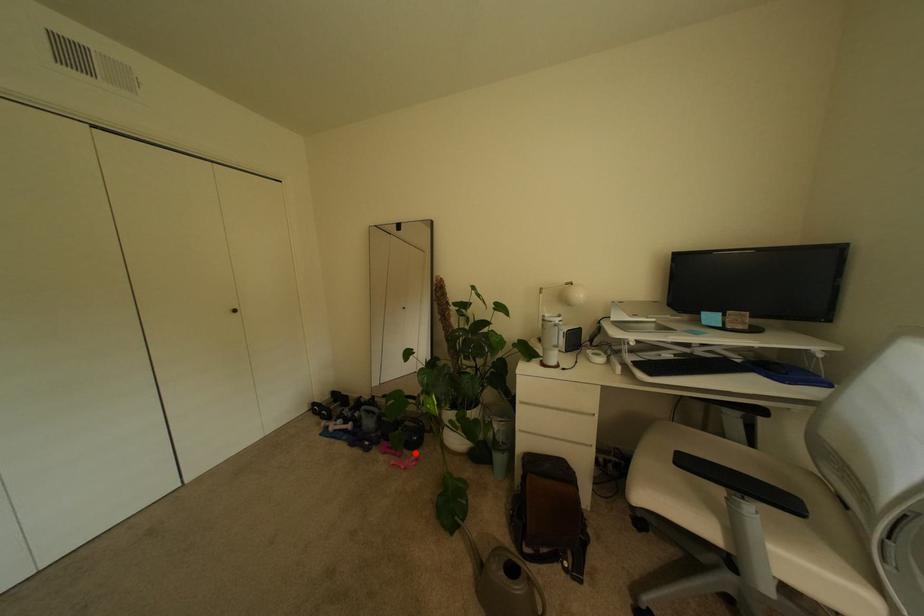
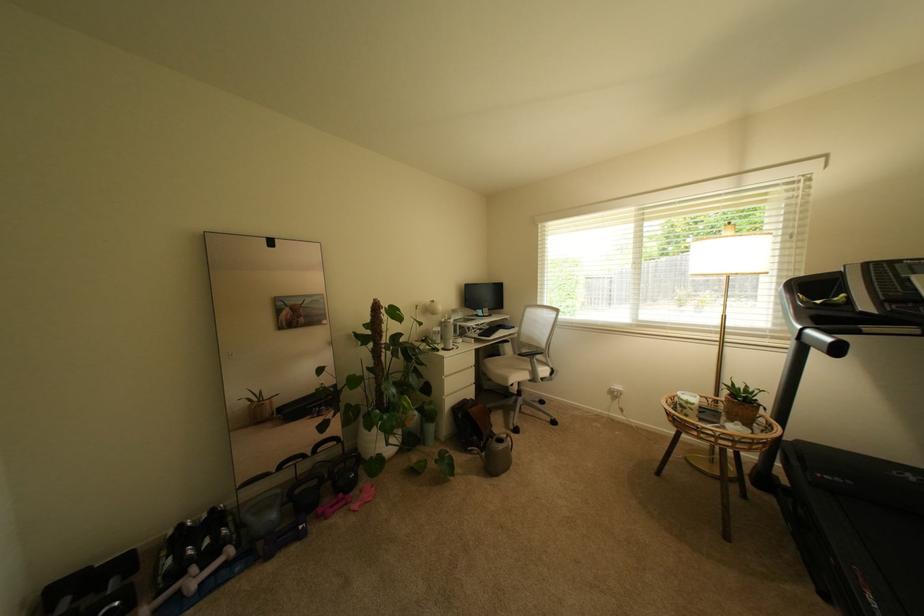
Where in the second image is the point corresponding to the highlighted location from the first image?

(359, 495)